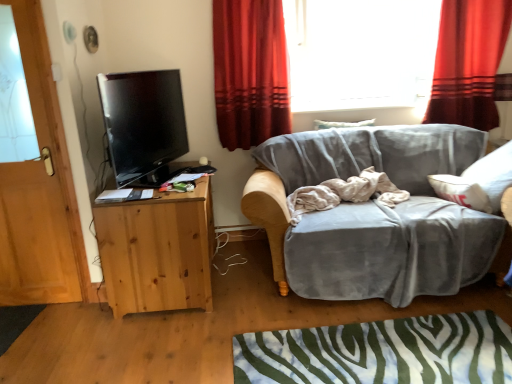
Question: Is natural wood cabinet at left with red velvet curtain at upper right, positioned as the first curtain in right-to-left order?

Choices:
 (A) yes
 (B) no

Answer: (B)

Question: Does natural wood cabinet at left come in front of red velvet curtain at upper right, positioned as the first curtain in right-to-left order?

Choices:
 (A) yes
 (B) no

Answer: (A)

Question: Is natural wood cabinet at left further to the viewer compared to red velvet curtain at upper right, which is the 2th curtain in left-to-right order?

Choices:
 (A) no
 (B) yes

Answer: (A)

Question: Considering the relative sizes of natural wood cabinet at left and red velvet curtain at upper right, positioned as the first curtain in right-to-left order, in the image provided, is natural wood cabinet at left thinner than red velvet curtain at upper right, positioned as the first curtain in right-to-left order,?

Choices:
 (A) no
 (B) yes

Answer: (A)

Question: Would you say natural wood cabinet at left is outside red velvet curtain at upper right, positioned as the first curtain in right-to-left order?

Choices:
 (A) yes
 (B) no

Answer: (A)

Question: Is wooden door at left taller or shorter than beige cotton blanket at center?

Choices:
 (A) tall
 (B) short

Answer: (A)

Question: Is wooden door at left bigger or smaller than beige cotton blanket at center?

Choices:
 (A) big
 (B) small

Answer: (A)

Question: Based on their positions, is wooden door at left located to the left or right of beige cotton blanket at center?

Choices:
 (A) left
 (B) right

Answer: (A)

Question: From a real-world perspective, is wooden door at left above or below beige cotton blanket at center?

Choices:
 (A) below
 (B) above

Answer: (B)

Question: In the image, is velvet gray couch at center positioned in front of or behind red velvet curtain at upper right, positioned as the first curtain in right-to-left order?

Choices:
 (A) behind
 (B) front

Answer: (B)

Question: From the image's perspective, is velvet gray couch at center above or below red velvet curtain at upper right, positioned as the first curtain in right-to-left order?

Choices:
 (A) below
 (B) above

Answer: (A)

Question: From a real-world perspective, is velvet gray couch at center above or below red velvet curtain at upper right, positioned as the first curtain in right-to-left order?

Choices:
 (A) above
 (B) below

Answer: (B)

Question: Based on their positions, is velvet gray couch at center located to the left or right of red velvet curtain at upper right, positioned as the first curtain in right-to-left order?

Choices:
 (A) right
 (B) left

Answer: (B)

Question: Considering the positions of beige cotton blanket at center and wooden door at left in the image, is beige cotton blanket at center taller or shorter than wooden door at left?

Choices:
 (A) tall
 (B) short

Answer: (B)

Question: Considering the relative positions of beige cotton blanket at center and wooden door at left in the image provided, is beige cotton blanket at center to the left or to the right of wooden door at left?

Choices:
 (A) left
 (B) right

Answer: (B)